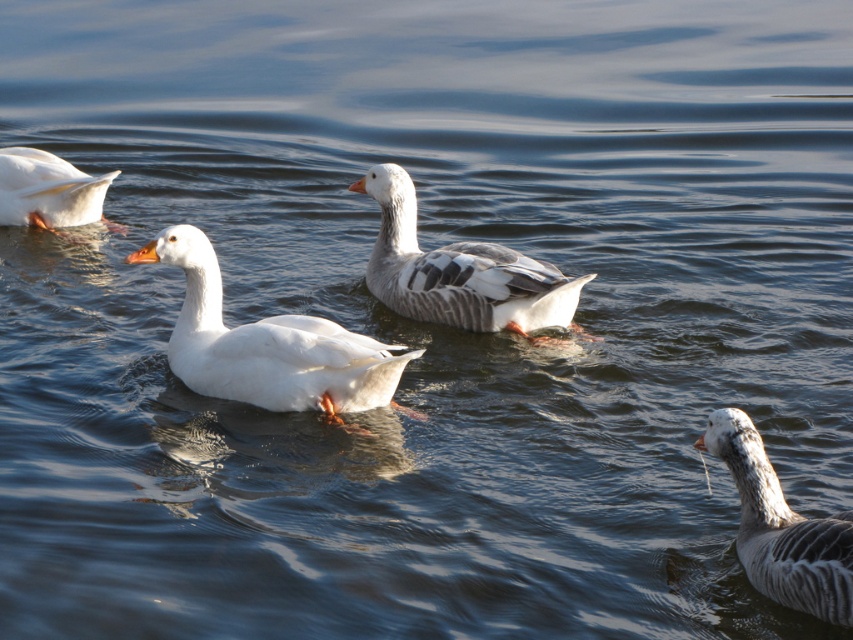
Between white matte duck at center and gray speckled duck at lower right, which one appears on the left side from the viewer's perspective?

white matte duck at center

Does point (418, 353) come in front of point (849, 589)?

No, it is behind (849, 589).

Image resolution: width=853 pixels, height=640 pixels. I want to click on white matte duck at center, so click(265, 344).

Who is taller, white matte duck at center or gray speckled duck at center?

white matte duck at center is taller.

Between point (314, 376) and point (474, 310), which one is positioned in front?

Point (314, 376) is in front.

The height and width of the screenshot is (640, 853). What are the coordinates of `white matte duck at center` in the screenshot? It's located at (265, 344).

Which is more to the left, gray speckled duck at center or gray speckled duck at lower right?

From the viewer's perspective, gray speckled duck at center appears more on the left side.

Which is behind, point (407, 193) or point (776, 529)?

The point (407, 193) is behind.

Where is `gray speckled duck at center`? gray speckled duck at center is located at coordinates (459, 272).